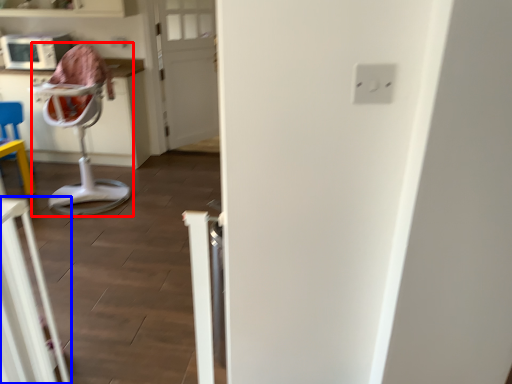
Question: Which object appears farthest to the camera in this image, feeding chair (highlighted by a red box) or furniture (highlighted by a blue box)?

Choices:
 (A) feeding chair
 (B) furniture

Answer: (A)